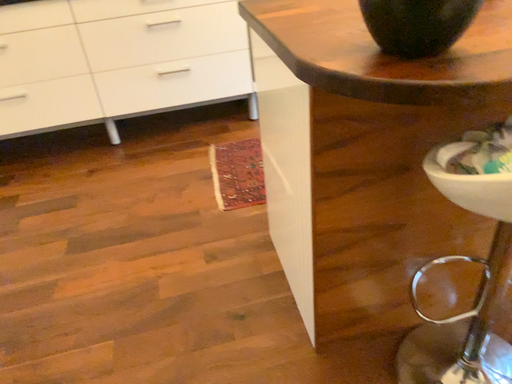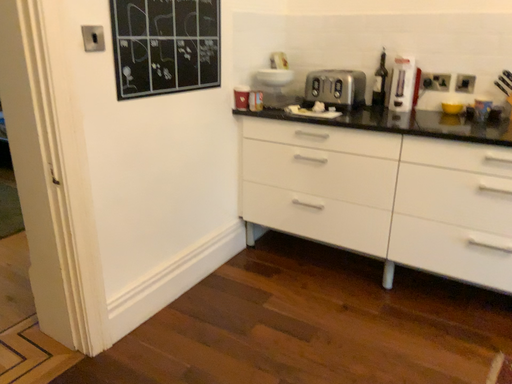
Question: Which way did the camera rotate in the video?

Choices:
 (A) rotated downward
 (B) rotated upward

Answer: (B)